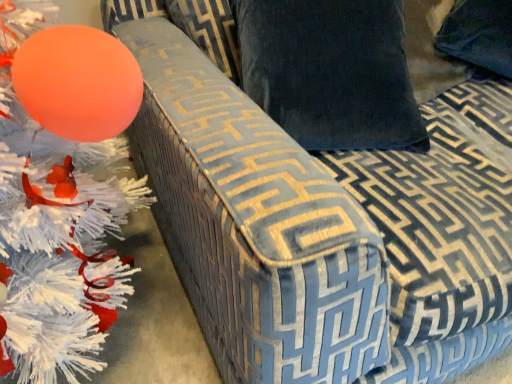
Describe the element at coordinates (331, 72) in the screenshot. The image size is (512, 384). I see `dark blue velvet pillow at center` at that location.

This screenshot has width=512, height=384. In order to click on dark blue velvet pillow at center in this screenshot , I will do `click(331, 72)`.

Identify the location of dark blue velvet pillow at center. The image size is (512, 384). click(331, 72).